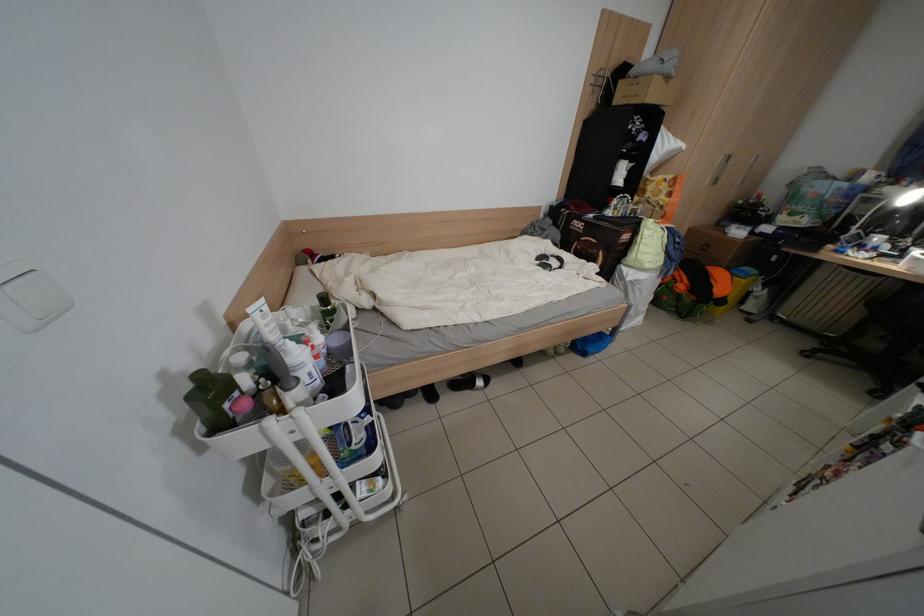
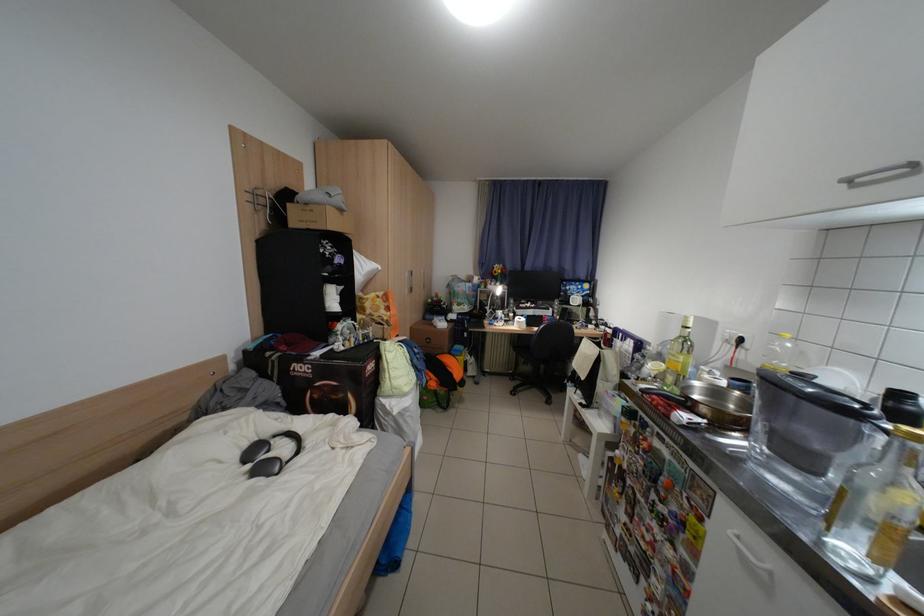
Question: Based on the continuous images, in which direction is the camera rotating? Reply with the corresponding letter.

Choices:
 (A) Left
 (B) Right
 (C) Up
 (D) Down

Answer: (B)